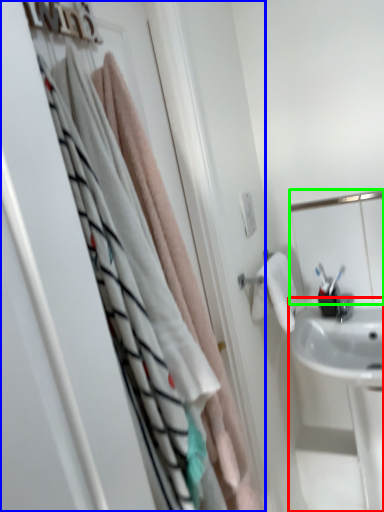
Question: Which is nearer to the sink (highlighted by a red box)? closet (highlighted by a blue box) or mirror (highlighted by a green box).

Choices:
 (A) closet
 (B) mirror

Answer: (B)